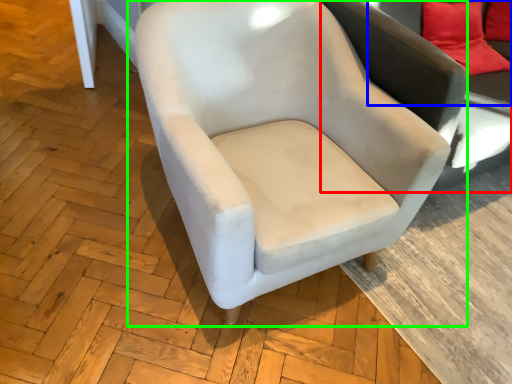
Question: Which object is positioned closest to swivel chair (highlighted by a red box)? Select from couch (highlighted by a blue box) and chair (highlighted by a green box).

Choices:
 (A) couch
 (B) chair

Answer: (B)